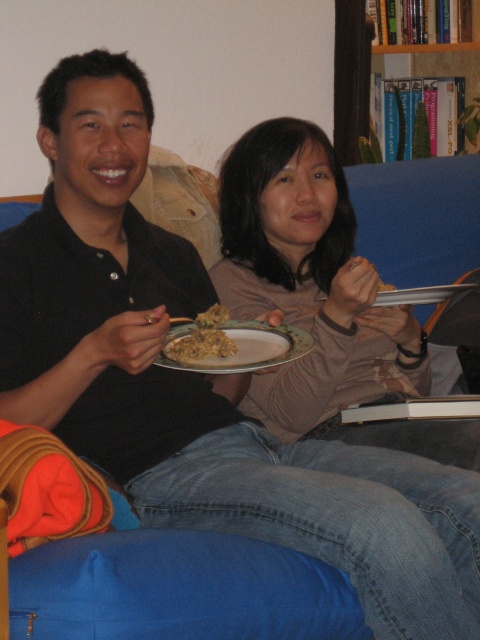
Consider the image. Is hardcover books at upper center shorter than brown matte plate at center?

Incorrect, hardcover books at upper center's height does not fall short of brown matte plate at center's.

Can you confirm if hardcover books at upper center is bigger than brown matte plate at center?

Indeed, hardcover books at upper center has a larger size compared to brown matte plate at center.

Find the location of a particular element. This screenshot has width=480, height=640. hardcover books at upper center is located at coordinates (361, 72).

Does matte pink sweater at center lie behind hardcover books at upper center?

No.

Between matte pink sweater at center and hardcover books at upper center, which one appears on the left side from the viewer's perspective?

Positioned to the left is matte pink sweater at center.

Does point (268, 208) come in front of point (339, 131)?

Yes, point (268, 208) is in front of point (339, 131).

What are the coordinates of `matte pink sweater at center` in the screenshot? It's located at (320, 298).

In order to click on matte ceramic plate at center in this screenshot , I will do `click(251, 348)`.

What do you see at coordinates (251, 348) in the screenshot? The width and height of the screenshot is (480, 640). I see `matte ceramic plate at center` at bounding box center [251, 348].

You are a GUI agent. You are given a task and a screenshot of the screen. Output one action in this format:
    pyautogui.click(x=<x>, y=<y>)
    Task: Click on the matte ceramic plate at center
    
    Given the screenshot: What is the action you would take?
    pyautogui.click(x=251, y=348)